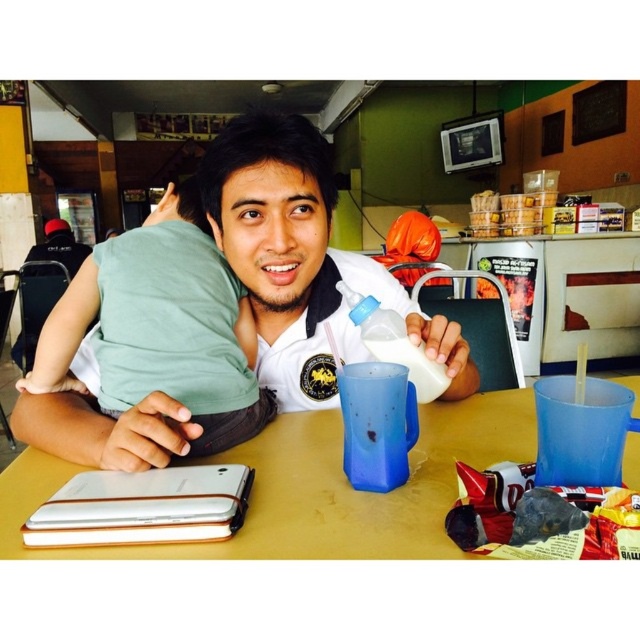
Who is more forward, (269, 536) or (429, 360)?

Point (269, 536) is more forward.

Can you confirm if yellow matte table at center is taller than white plastic bottle at center?

Incorrect, yellow matte table at center's height is not larger of white plastic bottle at center's.

Find the location of `yellow matte table at center`. yellow matte table at center is located at coordinates (314, 488).

This screenshot has width=640, height=640. Find the location of `yellow matte table at center`. yellow matte table at center is located at coordinates (314, 488).

Between white matte shirt at center and white plastic bottle at center, which one appears on the right side from the viewer's perspective?

From the viewer's perspective, white plastic bottle at center appears more on the right side.

Does white matte shirt at center appear over white plastic bottle at center?

Indeed, white matte shirt at center is positioned over white plastic bottle at center.

Image resolution: width=640 pixels, height=640 pixels. What are the coordinates of `white matte shirt at center` in the screenshot? It's located at (301, 260).

I want to click on white matte shirt at center, so click(x=301, y=260).

Who is positioned more to the left, white matte shirt at center or green cotton shirt at left?

From the viewer's perspective, green cotton shirt at left appears more on the left side.

Does point (224, 173) come farther from viewer compared to point (116, 340)?

Yes, point (224, 173) is farther from viewer.

At what (x,y) coordinates should I click in order to perform the action: click on white matte shirt at center. Please return your answer as a coordinate pair (x, y). The height and width of the screenshot is (640, 640). Looking at the image, I should click on 301,260.